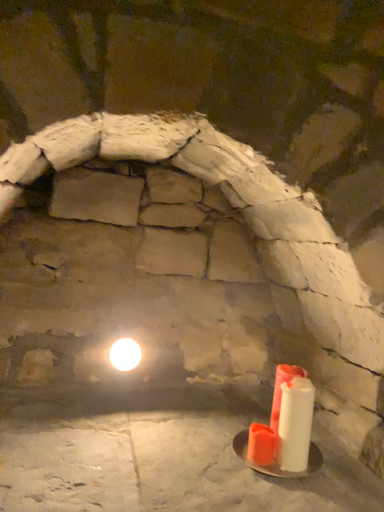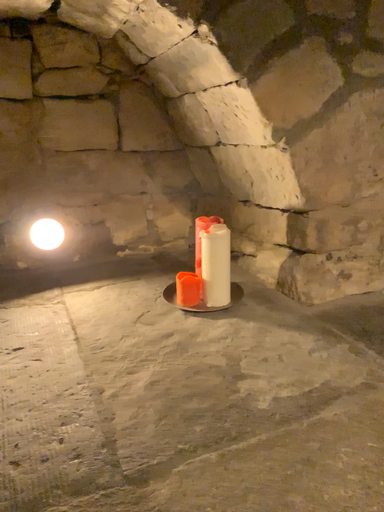
Question: Which way did the camera rotate in the video?

Choices:
 (A) rotated downward
 (B) rotated upward

Answer: (A)